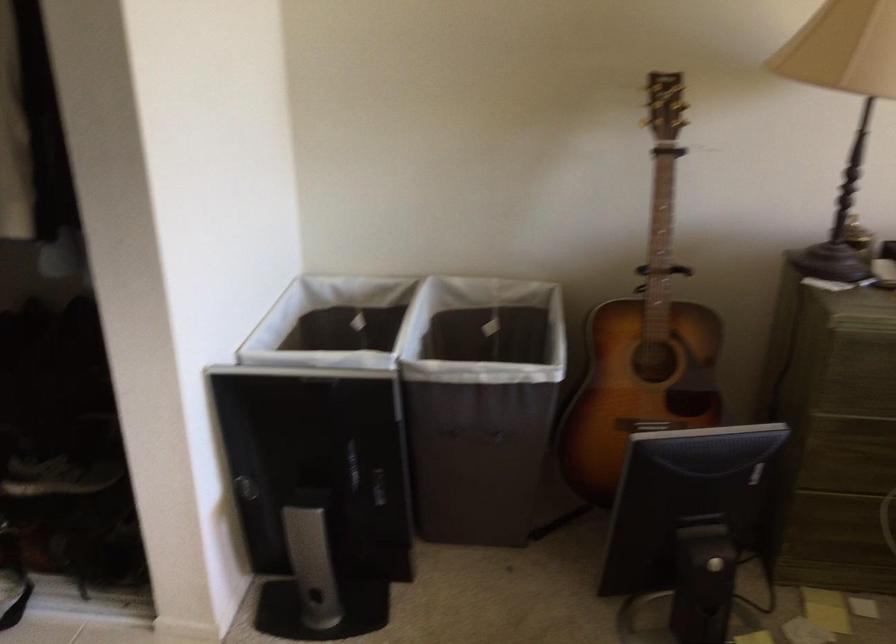
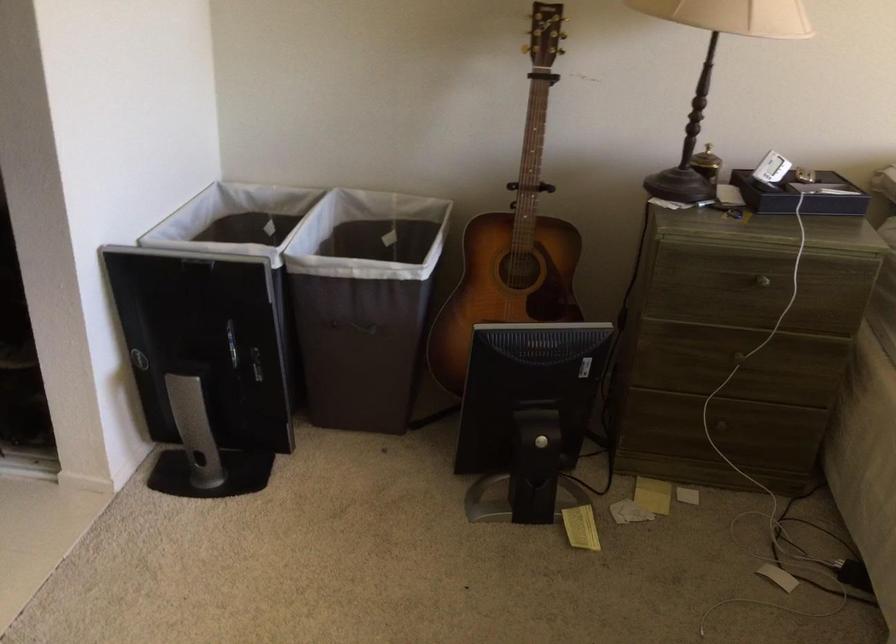
Find the pixel in the second image that matches [688,536] in the first image.

(528, 415)